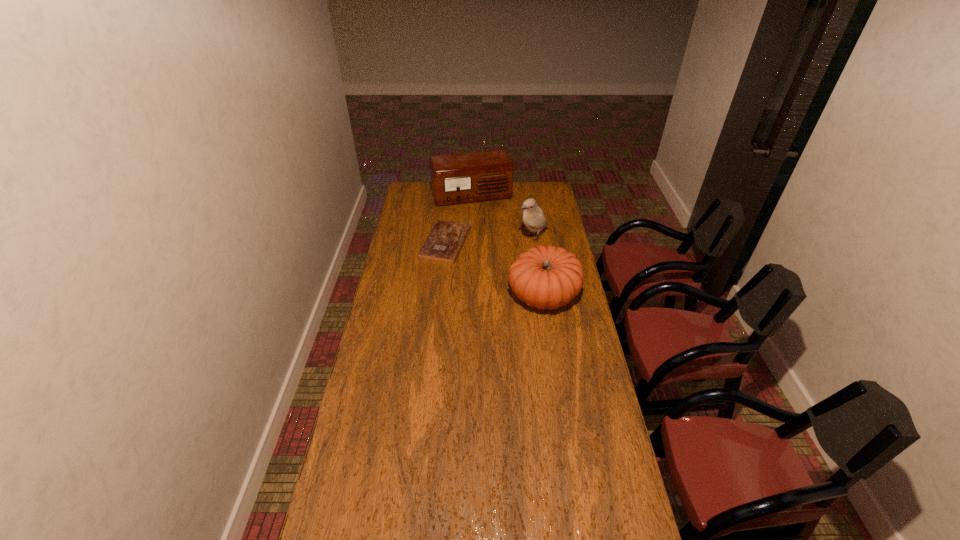
You are a GUI agent. You are given a task and a screenshot of the screen. Output one action in this format:
    pyautogui.click(x=<x>, y=<y>)
    Task: Click on the vacant space at the far left corner
    This screenshot has width=960, height=540.
    Given the screenshot: What is the action you would take?
    pyautogui.click(x=428, y=200)

This screenshot has height=540, width=960. In order to click on free space that is in between the radio receiver and the shortest object in this screenshot , I will do `click(459, 219)`.

Locate an element on the screen. The image size is (960, 540). empty location between the nearest object and the Bible is located at coordinates (494, 269).

The width and height of the screenshot is (960, 540). I want to click on vacant space that's between the Bible and the nearest object, so click(494, 269).

This screenshot has height=540, width=960. I want to click on unoccupied position between the shortest object and the bird, so click(490, 240).

The image size is (960, 540). Find the location of `free space between the farthest object and the shortest object`. free space between the farthest object and the shortest object is located at coordinates (459, 219).

Where is `free area in between the Bible and the pumpkin`? This screenshot has height=540, width=960. free area in between the Bible and the pumpkin is located at coordinates (494, 269).

At what (x,y) coordinates should I click in order to perform the action: click on free space between the farthest object and the pumpkin. Please return your answer as a coordinate pair (x, y). The width and height of the screenshot is (960, 540). Looking at the image, I should click on (508, 246).

Where is `vacant area between the bird and the radio receiver`? This screenshot has height=540, width=960. vacant area between the bird and the radio receiver is located at coordinates (x=502, y=217).

In order to click on vacant area that lies between the nearest object and the farthest object in this screenshot , I will do `click(508, 246)`.